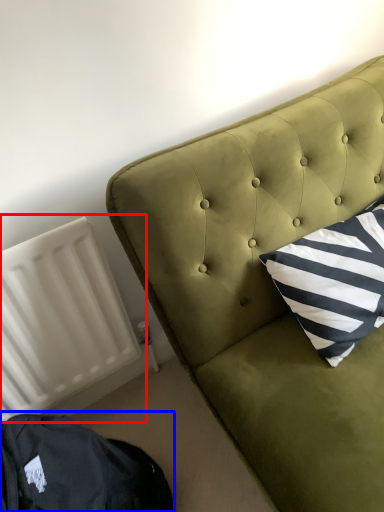
Question: Which point is further to the camera, radiator (highlighted by a red box) or bean bag chair (highlighted by a blue box)?

Choices:
 (A) radiator
 (B) bean bag chair

Answer: (A)